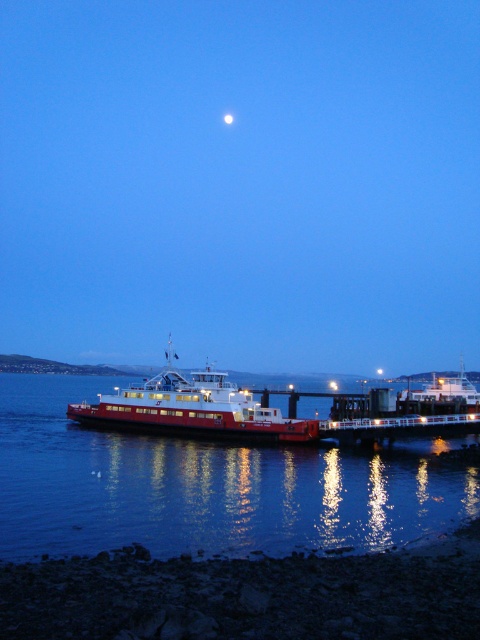
You are standing on the smooth sand shoreline at lower left and want to board the red matte ferry at center. Which direction should you walk to reach the ferry?

The smooth sand shoreline at lower left is positioned under the red matte ferry at center, so you should walk upwards to reach the ferry.

You are a photographer trying to capture the reflection of the ferry boat on the glossy water at lower left and the smooth sand shoreline at lower left. Which surface will show a clearer reflection of the ferry boat?

The glossy water at lower left will show a clearer reflection of the ferry boat because it has a greater height compared to the smooth sand shoreline at lower left, allowing for a more defined reflection.